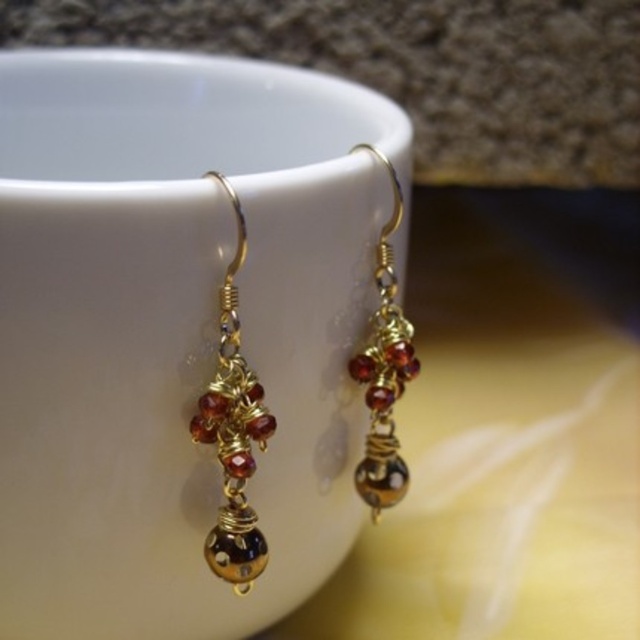
You are an appraiser examining two pairs of gold wire wrapped earrings at left and gold wire wrapped earrings at center displayed in a showcase. Which pair appears closer to you?

The gold wire wrapped earrings at left appears closer to you because it is positioned closer to the viewer than the gold wire wrapped earrings at center.

You are an appraiser examining two pairs of gold wire wrapped earrings at left and gold wire wrapped earrings at center. Which pair is positioned lower in the image?

The gold wire wrapped earrings at left is below gold wire wrapped earrings at center, so the pair at left is positioned lower in the image.